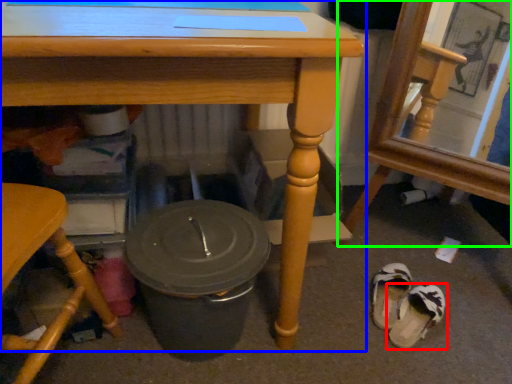
Question: Based on their relative distances, which object is farther from footwear (highlighted by a red box)? Choose from table (highlighted by a blue box) and chair (highlighted by a green box).

Choices:
 (A) table
 (B) chair

Answer: (A)